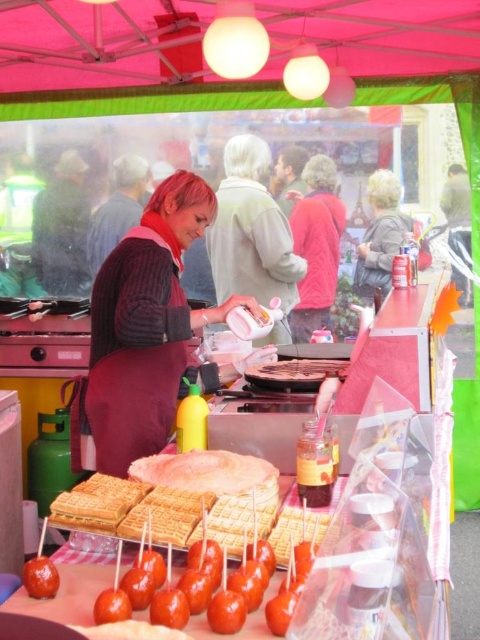
Question: Among these objects, which one is nearest to the camera?

Choices:
 (A) shiny caramel apples at center
 (B) matte maroon sweater at center
 (C) matte gray sweater at center

Answer: (A)

Question: Considering the real-world distances, which object is farthest from the shiny caramel apples at center?

Choices:
 (A) golden waffle at center
 (B) matte maroon sweater at center
 (C) matte red sweater at center

Answer: (C)

Question: Is matte maroon sweater at center smaller than gray woolen sweater at upper right?

Choices:
 (A) no
 (B) yes

Answer: (A)

Question: Which point is closer to the camera taking this photo?

Choices:
 (A) (356, 285)
 (B) (289, 374)
 (C) (83, 392)

Answer: (B)

Question: Is matte gray sweater at center to the left of glossy caramel apple at lower left from the viewer's perspective?

Choices:
 (A) no
 (B) yes

Answer: (A)

Question: Does matte gray sweater at center appear under gray woolen sweater at upper right?

Choices:
 (A) yes
 (B) no

Answer: (A)